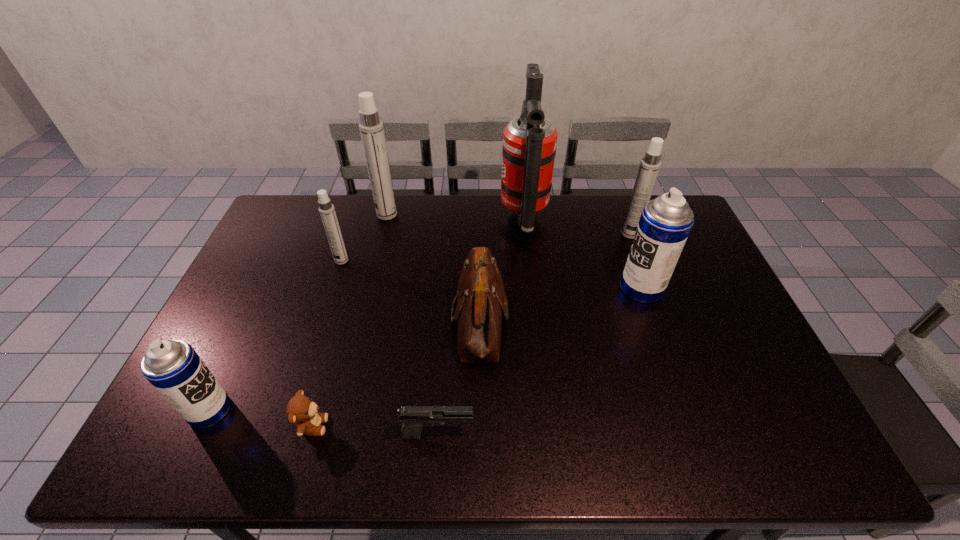
Identify the location of blank area located on the label side of the second nearest aerosol can. The image size is (960, 540). (582, 288).

Where is `vacant space located on the label side of the second nearest aerosol can`? vacant space located on the label side of the second nearest aerosol can is located at coordinates (553, 288).

This screenshot has height=540, width=960. Find the location of `free space located 0.390m on the front of the smallest white aerosol can`. free space located 0.390m on the front of the smallest white aerosol can is located at coordinates (307, 366).

Image resolution: width=960 pixels, height=540 pixels. In order to click on free point located on the label side of the leftmost object in this screenshot , I will do `click(372, 410)`.

This screenshot has width=960, height=540. In order to click on free space located on the left of the brown shoulder bag in this screenshot , I will do `click(403, 320)`.

Identify the location of vacant region located 0.130m aim along the barrel of the pistol. (529, 434).

The image size is (960, 540). In order to click on vacant region located 0.080m on the face of the teddy bear in this screenshot , I will do `click(361, 426)`.

This screenshot has width=960, height=540. Find the location of `fire extinguisher at the far edge`. fire extinguisher at the far edge is located at coordinates (529, 141).

Identify the location of aerosol can at the near edge. The height and width of the screenshot is (540, 960). (173, 367).

Locate an element on the screen. This screenshot has width=960, height=540. pistol that is positioned at the near edge is located at coordinates (413, 418).